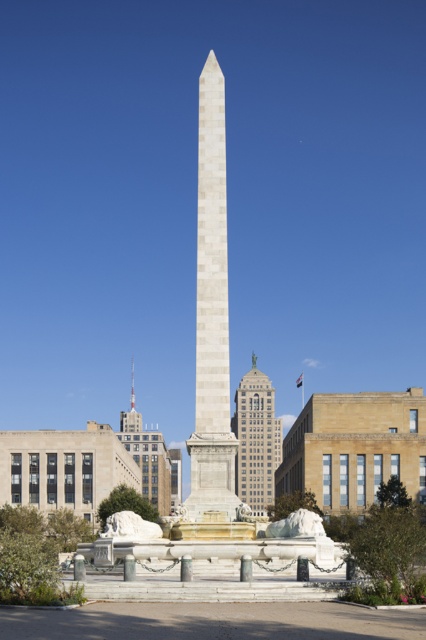
Does white marble obelisk at center appear on the left side of gray stone building at center?

Yes, white marble obelisk at center is to the left of gray stone building at center.

Can you confirm if white marble obelisk at center is positioned to the right of gray stone building at center?

No, white marble obelisk at center is not to the right of gray stone building at center.

Locate an element on the screen. Image resolution: width=426 pixels, height=640 pixels. white marble obelisk at center is located at coordinates (212, 320).